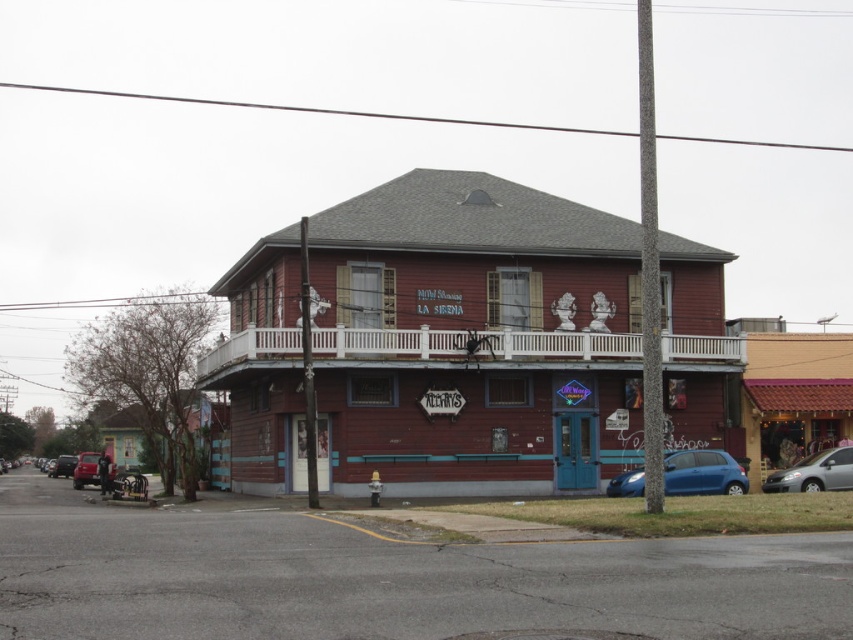
Does matte blue car at lower right have a lesser height compared to metallic red car at lower left?

Indeed, matte blue car at lower right has a lesser height compared to metallic red car at lower left.

Between matte blue car at lower right and metallic red car at lower left, which one has less height?

matte blue car at lower right

Is point (624, 484) positioned behind point (77, 461)?

No.

Where is `matte blue car at lower right`? matte blue car at lower right is located at coordinates (703, 474).

Can you confirm if silver metallic van at lower right is smaller than matte red car at left?

Indeed, silver metallic van at lower right has a smaller size compared to matte red car at left.

In order to click on silver metallic van at lower right in this screenshot , I will do `click(814, 472)`.

Who is more forward, (773, 474) or (67, 458)?

Positioned in front is point (773, 474).

Where is `silver metallic van at lower right`? silver metallic van at lower right is located at coordinates (814, 472).

You are a GUI agent. You are given a task and a screenshot of the screen. Output one action in this format:
    pyautogui.click(x=<x>, y=<y>)
    Task: Click on the silver metallic van at lower right
    The height and width of the screenshot is (640, 853).
    Given the screenshot: What is the action you would take?
    pyautogui.click(x=814, y=472)

Describe the element at coordinates (814, 472) in the screenshot. The height and width of the screenshot is (640, 853). I see `silver metallic van at lower right` at that location.

Where is `silver metallic van at lower right`? The image size is (853, 640). silver metallic van at lower right is located at coordinates (814, 472).